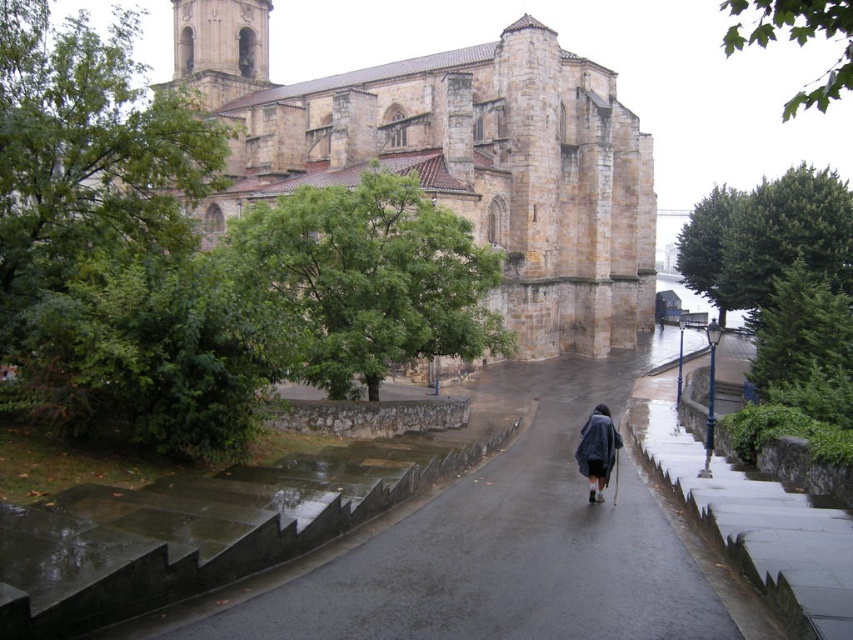
You are standing at the base of the brown stone church at upper center and want to place a 75 meter long banner from the base to the top of the bell tower. Will the banner be long enough?

The distance between the base of the brown stone church at upper center and the top of the bell tower is 77.09 meters. Since the banner is only 75 meters long, it will not be long enough to reach from the base to the top of the bell tower.

You are standing at the entrance of the brown stone church at upper center. Looking around, you notice a paved pathway leading towards the building. Where is the pathway in relation to the church?

The pathway is located in the foreground of the brown stone church at upper center, leading towards it.

You are standing at the entrance of the historic stone building and see a smooth asphalt road at center and a dark blue fabric coat at center. Which object is positioned to the left?

The smooth asphalt road at center is to the left of dark blue fabric coat at center.